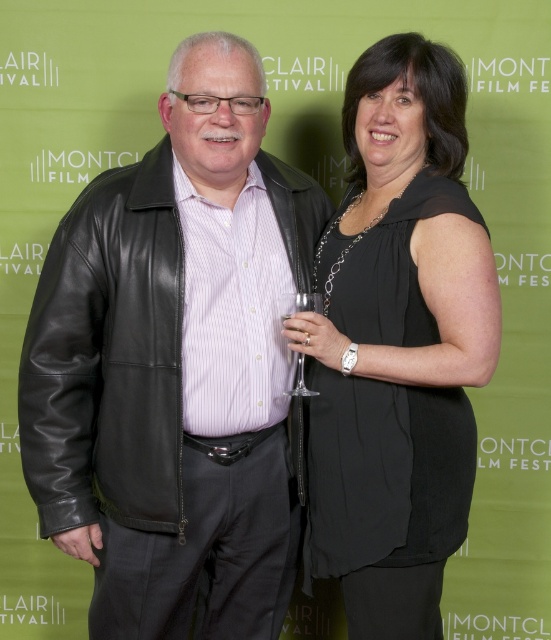
Question: Is black leather jacket at center above black satin dress at center?

Choices:
 (A) yes
 (B) no

Answer: (B)

Question: Can you confirm if black leather jacket at center is positioned below clear glass wine glass at center?

Choices:
 (A) yes
 (B) no

Answer: (A)

Question: Estimate the real-world distances between objects in this image. Which object is farther from the black leather jacket at center?

Choices:
 (A) clear glass wine glass at center
 (B) black satin dress at center

Answer: (A)

Question: Which of these objects is positioned farthest from the black satin dress at center?

Choices:
 (A) clear glass wine glass at center
 (B) black leather jacket at center

Answer: (B)

Question: Which object is the closest to the black leather jacket at center?

Choices:
 (A) black satin dress at center
 (B) clear glass wine glass at center

Answer: (A)

Question: Is black satin dress at center bigger than clear glass wine glass at center?

Choices:
 (A) yes
 (B) no

Answer: (A)